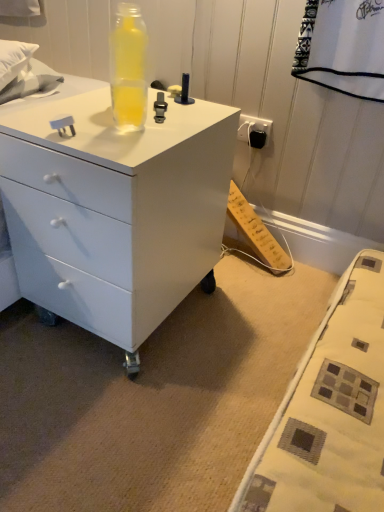
Identify the location of vacant area located to the right-hand side of transparent plastic bottle at upper center. (190, 120).